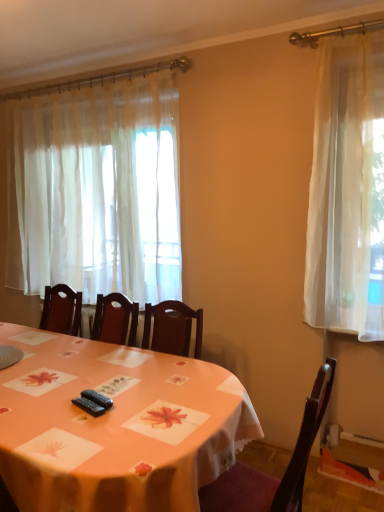
Locate an element on the screen. The width and height of the screenshot is (384, 512). orange fabric table at center is located at coordinates (115, 426).

What do you see at coordinates (115, 426) in the screenshot?
I see `orange fabric table at center` at bounding box center [115, 426].

The width and height of the screenshot is (384, 512). What are the coordinates of `wooden chair at center` in the screenshot? It's located at (270, 476).

Locate an element on the screen. sheer white curtain at left is located at coordinates coord(96,191).

What do you see at coordinates (96, 191) in the screenshot? The height and width of the screenshot is (512, 384). I see `sheer white curtain at left` at bounding box center [96, 191].

At what (x,y) coordinates should I click in order to perform the action: click on orange fabric table at center. Please return your answer as a coordinate pair (x, y). This screenshot has width=384, height=512. Looking at the image, I should click on (115, 426).

Considering the relative positions of orange fabric table at center and sheer white curtain at left in the image provided, is orange fabric table at center to the left or to the right of sheer white curtain at left?

orange fabric table at center is to the right of sheer white curtain at left.

From the image's perspective, is orange fabric table at center above or below sheer white curtain at left?

orange fabric table at center is situated lower than sheer white curtain at left in the image.

From a real-world perspective, is orange fabric table at center located higher than sheer white curtain at left?

No.

Between orange fabric table at center and sheer white curtain at left, which one is positioned in front?

orange fabric table at center is in front.

Visually, is orange fabric table at center positioned to the left or to the right of wooden chair at center?

From the image, it's evident that orange fabric table at center is to the left of wooden chair at center.

Are orange fabric table at center and wooden chair at center beside each other?

orange fabric table at center is not next to wooden chair at center, and they're not touching.

Between orange fabric table at center and wooden chair at center, which one has smaller size?

wooden chair at center is smaller.

Is point (280, 494) positioned before point (218, 444)?

Yes, it is in front of point (218, 444).

Which is correct: wooden chair at center is inside orange fabric table at center, or outside of it?

wooden chair at center can be found inside orange fabric table at center.

How different are the orientations of wooden chair at center and orange fabric table at center in degrees?

There is a 90-degree angle between the facing directions of wooden chair at center and orange fabric table at center.

Which object is positioned more to the right, sheer white curtain at left or wooden chair at center?

Positioned to the right is wooden chair at center.

Looking at this image, what's the angular difference between sheer white curtain at left and wooden chair at center's facing directions?

They differ by 90.2 degrees in their facing directions.

From the image's perspective, which one is positioned higher, sheer white curtain at left or wooden chair at center?

sheer white curtain at left.

Looking at this image, between sheer white curtain at left and orange fabric table at center, which one has smaller width?

Thinner between the two is sheer white curtain at left.

Does sheer white curtain at left contain orange fabric table at center?

Definitely not — orange fabric table at center is not inside sheer white curtain at left.

How many degrees apart are the facing directions of sheer white curtain at left and orange fabric table at center?

The angular difference between sheer white curtain at left and orange fabric table at center is 0.212 degrees.

How distant is wooden chair at center from sheer white curtain at left?

They are 6.07 feet apart.

Considering the relative sizes of wooden chair at center and sheer white curtain at left in the image provided, is wooden chair at center bigger than sheer white curtain at left?

Actually, wooden chair at center might be smaller than sheer white curtain at left.

Which point is more distant from viewer, (234, 483) or (107, 155)?

The point (107, 155) is behind.

From the picture: Considering the relative sizes of wooden chair at center and sheer white curtain at left in the image provided, is wooden chair at center shorter than sheer white curtain at left?

Indeed, wooden chair at center has a lesser height compared to sheer white curtain at left.

What are the coordinates of `table on the right of sheer white curtain at left` in the screenshot? It's located at (115, 426).

Identify the location of table located in front of the wooden chair at center. (115, 426).

Considering their positions, is wooden chair at center positioned closer to sheer white curtain at left than orange fabric table at center?

orange fabric table at center is closer to sheer white curtain at left.

Which object lies nearer to the anchor point orange fabric table at center, wooden chair at center or sheer white curtain at left?

wooden chair at center is positioned closer to the anchor orange fabric table at center.

Considering their positions, is orange fabric table at center positioned closer to sheer white curtain at left than wooden chair at center?

orange fabric table at center lies closer to sheer white curtain at left than the other object.

Looking at the image, which one is located further to orange fabric table at center, sheer white curtain at left or wooden chair at center?

sheer white curtain at left.

Estimate the real-world distances between objects in this image. Which object is further from wooden chair at center, sheer white curtain at left or orange fabric table at center?

Based on the image, sheer white curtain at left appears to be further to wooden chair at center.

Based on their spatial positions, is orange fabric table at center or sheer white curtain at left closer to wooden chair at center?

The object closer to wooden chair at center is orange fabric table at center.

Where is `chair between orange fabric table at center and sheer white curtain at left in the front-back direction`? The image size is (384, 512). chair between orange fabric table at center and sheer white curtain at left in the front-back direction is located at coordinates [270, 476].